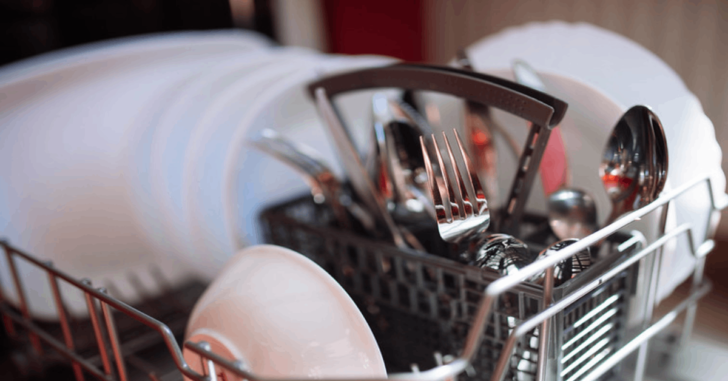
Identify the location of plates. This screenshot has height=381, width=728. (577, 57), (82, 118), (138, 140), (170, 146), (209, 159), (249, 179).